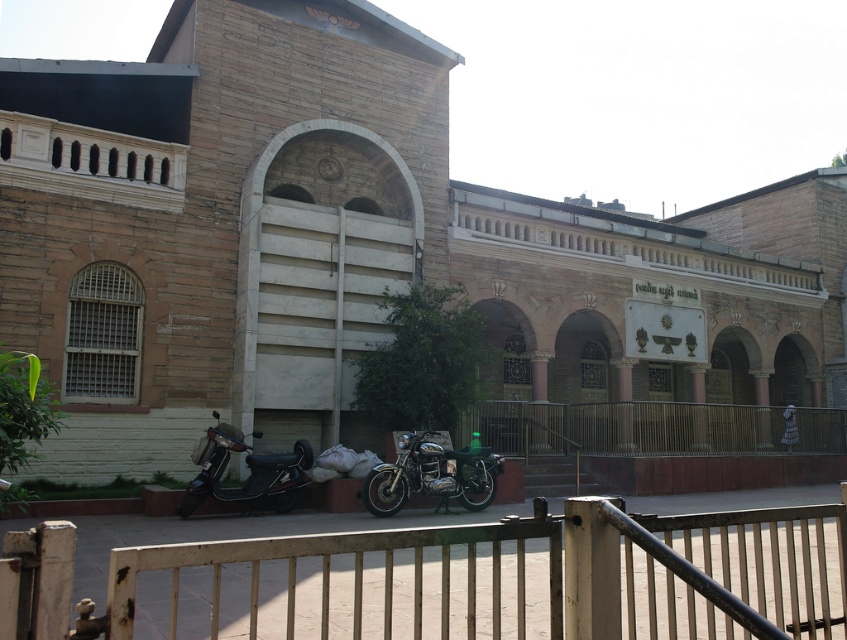
Is rusty metal gate at lower center taller than black matte scooter at lower left?

Indeed, rusty metal gate at lower center has a greater height compared to black matte scooter at lower left.

Does rusty metal gate at lower center appear on the left side of black matte scooter at lower left?

Incorrect, rusty metal gate at lower center is not on the left side of black matte scooter at lower left.

Which is in front, point (590, 557) or point (209, 474)?

Point (590, 557)

The height and width of the screenshot is (640, 847). What are the coordinates of `rusty metal gate at lower center` in the screenshot? It's located at (513, 577).

Is rusty metal gate at lower center thinner than shiny metallic motorcycle at center?

No, rusty metal gate at lower center is not thinner than shiny metallic motorcycle at center.

Which is in front, point (676, 525) or point (408, 490)?

Point (676, 525) is more forward.

Between point (67, 536) and point (495, 452), which one is positioned behind?

The point (495, 452) is behind.

At what (x,y) coordinates should I click in order to perform the action: click on rusty metal gate at lower center. Please return your answer as a coordinate pair (x, y). This screenshot has height=640, width=847. Looking at the image, I should click on (513, 577).

At what (x,y) coordinates should I click in order to perform the action: click on shiny metallic motorcycle at center. Please return your answer as a coordinate pair (x, y). This screenshot has width=847, height=640. Looking at the image, I should click on (430, 476).

At what (x,y) coordinates should I click in order to perform the action: click on shiny metallic motorcycle at center. Please return your answer as a coordinate pair (x, y). Looking at the image, I should click on (430, 476).

Locate an element on the screen. shiny metallic motorcycle at center is located at coordinates (430, 476).